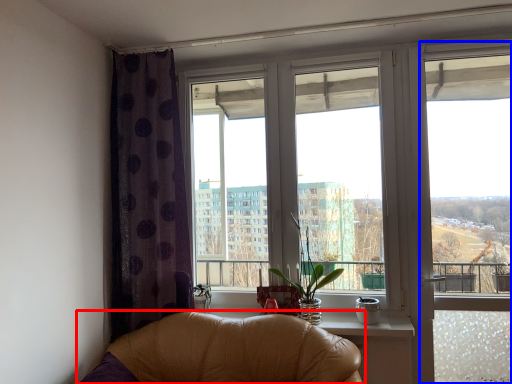
Question: Which object is further to the camera taking this photo, chair (highlighted by a red box) or window frame (highlighted by a blue box)?

Choices:
 (A) chair
 (B) window frame

Answer: (B)